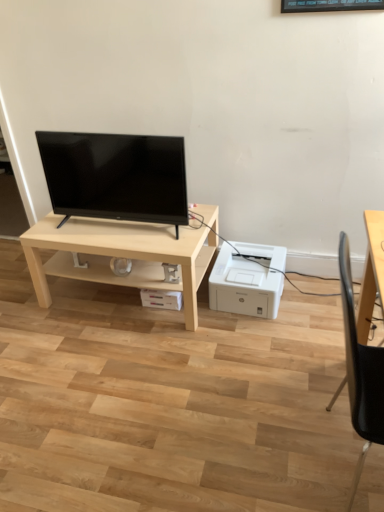
Locate an element on the screen. The image size is (384, 512). free space to the left of light wood table at center is located at coordinates (30, 309).